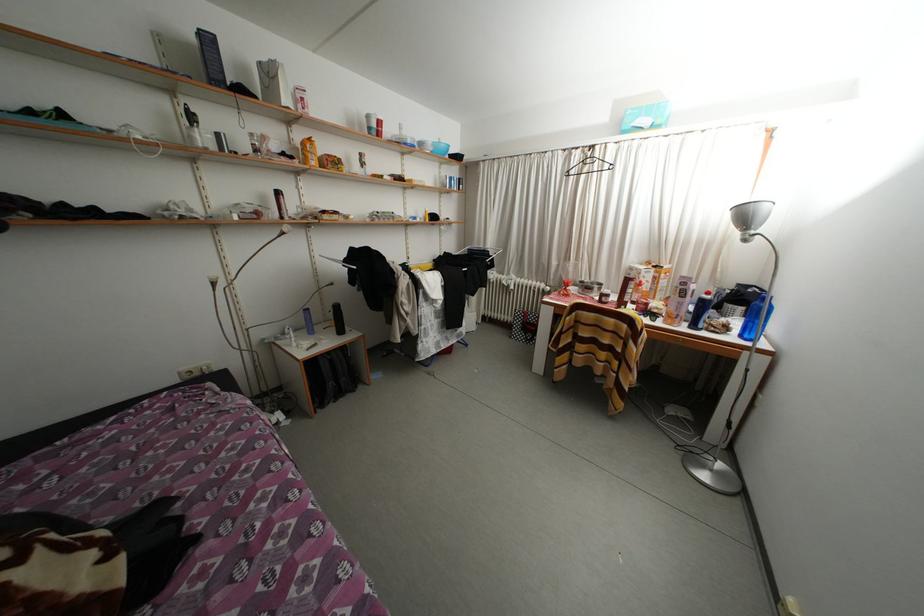
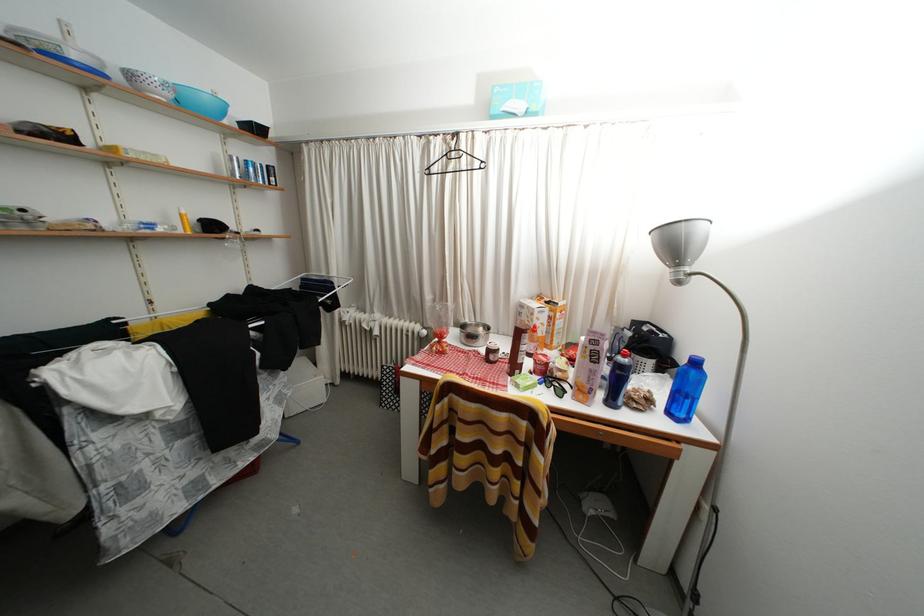
Locate, in the second image, the point that corresponds to point (752, 223) in the first image.

(681, 251)